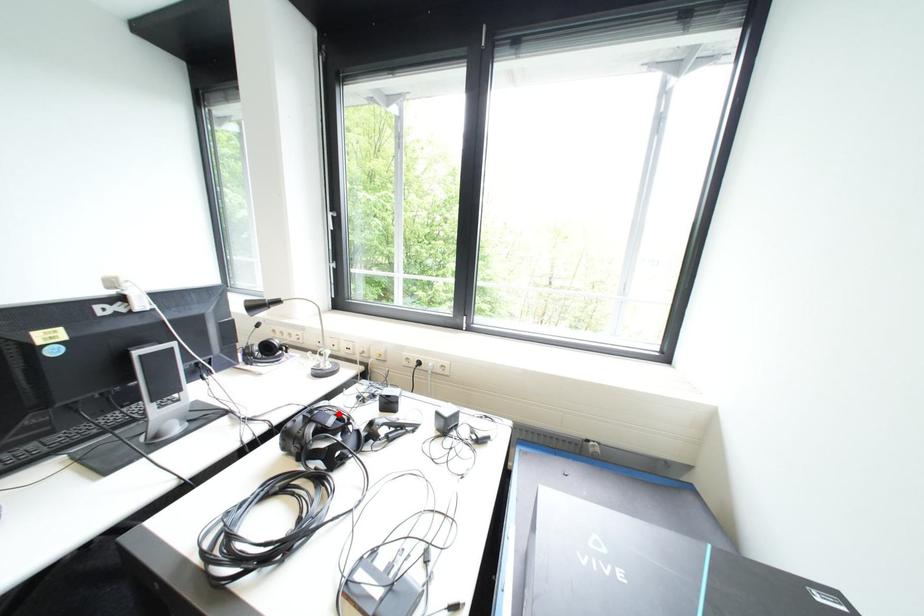
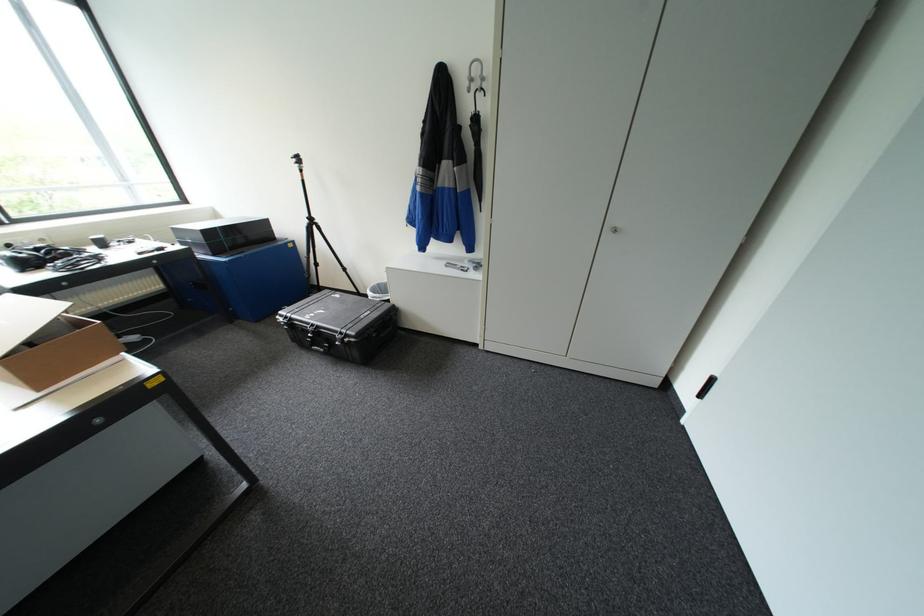
Question: I am providing you with two images of the same scene from different viewpoints. A red point is marked on the first image. Is the red point's position out of view in image 2?

Choices:
 (A) Yes
 (B) No

Answer: (A)